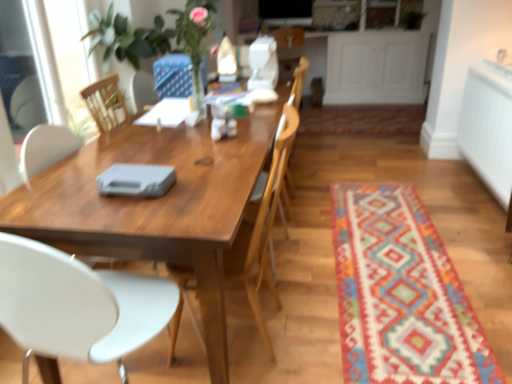
Where is `vacant point to the right of wooden chair at center, which is counted as the 1th armchair, starting from the right`? This screenshot has width=512, height=384. vacant point to the right of wooden chair at center, which is counted as the 1th armchair, starting from the right is located at coordinates (320, 198).